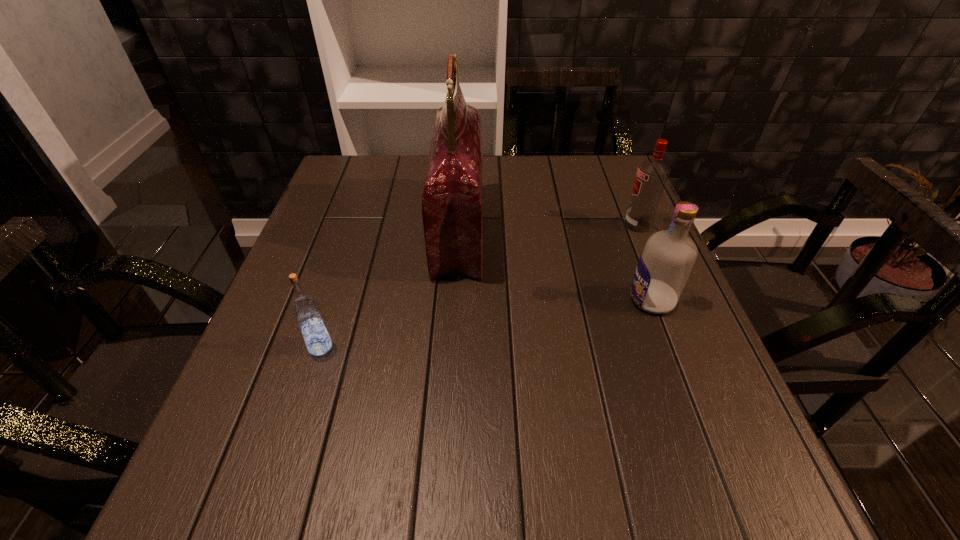
Locate which object is the third closest to the second object from left to right. Please provide its 2D coordinates. Your answer should be formatted as a tuple, i.e. [(x, y)], where the tuple contains the x and y coordinates of a point satisfying the conditions above.

[(652, 174)]

Identify the location of vodka that is the second closest to the nearest vodka. This screenshot has width=960, height=540. (652, 174).

What are the coordinates of `vodka identified as the closest to the farthest vodka` in the screenshot? It's located at click(x=666, y=261).